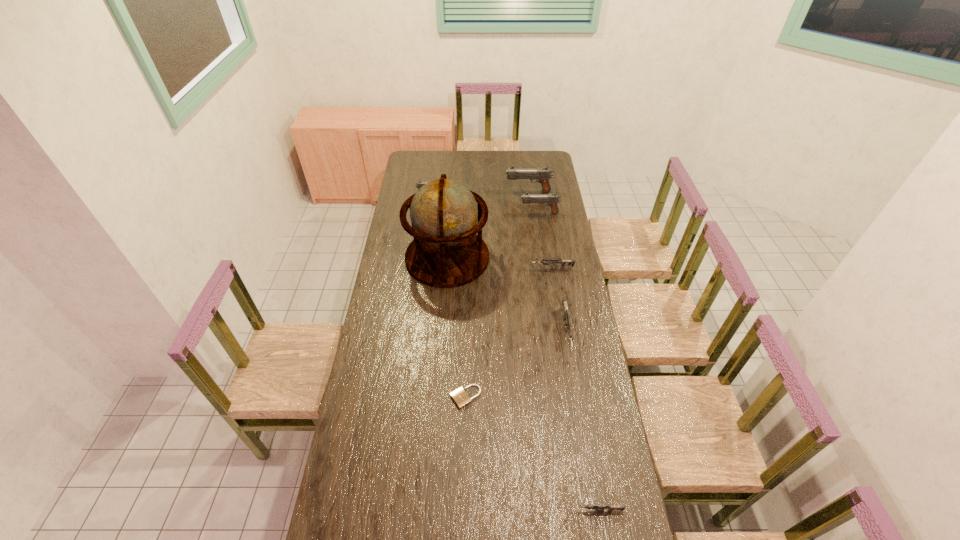
Identify the location of the farthest grey gun. (545, 262).

Where is `the smallest grey gun`? Image resolution: width=960 pixels, height=540 pixels. the smallest grey gun is located at coordinates (598, 507).

Identify the location of the seventh tallest object. Image resolution: width=960 pixels, height=540 pixels. (598, 507).

I want to click on padlock, so click(x=460, y=397).

This screenshot has height=540, width=960. What are the coordinates of `beige padlock` in the screenshot? It's located at (460, 397).

At what (x,y) coordinates should I click in order to perform the action: click on free location located 0.070m on the front-facing side of the globe. Please return your answer as a coordinate pair (x, y). The width and height of the screenshot is (960, 540). Looking at the image, I should click on (444, 300).

Locate an element on the screen. The height and width of the screenshot is (540, 960). vacant space located in the direction the farthest gun is aimed is located at coordinates (436, 192).

You are a GUI agent. You are given a task and a screenshot of the screen. Output one action in this format:
    pyautogui.click(x=<x>, y=<y>)
    Task: Click on the free point located in the direction the farthest gun is aimed
    The width and height of the screenshot is (960, 540).
    Given the screenshot: What is the action you would take?
    pyautogui.click(x=483, y=192)

Locate an element on the screen. This screenshot has height=540, width=960. vacant region located in the direction the farthest gun is aimed is located at coordinates tap(459, 192).

Locate an element on the screen. The width and height of the screenshot is (960, 540). vacant space located 0.280m in the direction the fourth nearest gun is aimed is located at coordinates (469, 213).